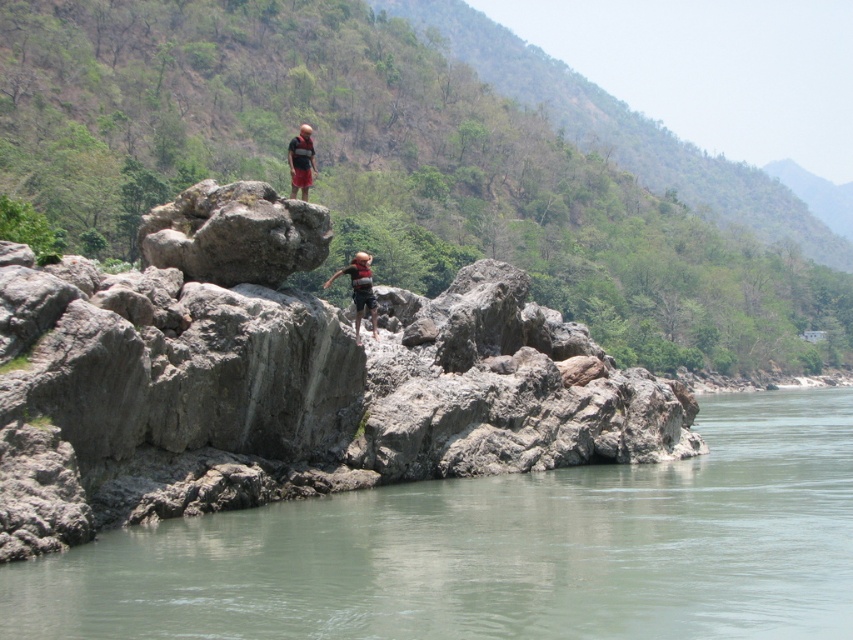
You are standing at the point labeled point (90, 625) and want to walk to the nearest safe path. The nearest safe path is 30 feet away from you. Can you reach it without exceeding the safe distance?

The distance between point (90, 625) and the viewer is 35.86 feet, which is greater than the 30 feet safe distance. Therefore, you cannot reach the nearest safe path within the safe distance.

You are standing at the point marked by the coordinates point (498,550) in the riverside scene. Looking around, you see a gray rock at lower left. Which direction should you walk to reach the gray rock at lower left from your current position?

Since you are already at the point corresponding to the gray rock at lower left, you don not need to walk anywhere else.